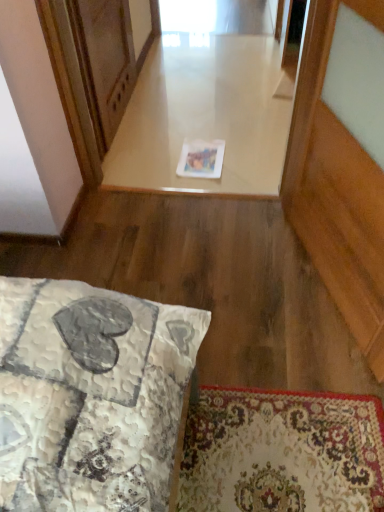
Question: Considering their positions, is white glossy paper at center located in front of or behind wooden screen door at upper left?

Choices:
 (A) front
 (B) behind

Answer: (B)

Question: From a real-world perspective, is white glossy paper at center above or below wooden screen door at upper left?

Choices:
 (A) above
 (B) below

Answer: (B)

Question: Visually, is white glossy paper at center positioned to the left or to the right of wooden screen door at upper left?

Choices:
 (A) left
 (B) right

Answer: (B)

Question: From the image's perspective, is wooden screen door at upper left located above or below white glossy paper at center?

Choices:
 (A) below
 (B) above

Answer: (B)

Question: Considering the positions of wooden screen door at upper left and white glossy paper at center in the image, is wooden screen door at upper left wider or thinner than white glossy paper at center?

Choices:
 (A) thin
 (B) wide

Answer: (A)

Question: Would you say wooden screen door at upper left is inside or outside white glossy paper at center?

Choices:
 (A) outside
 (B) inside

Answer: (A)

Question: Is point (96, 38) closer or farther from the camera than point (193, 129)?

Choices:
 (A) farther
 (B) closer

Answer: (B)